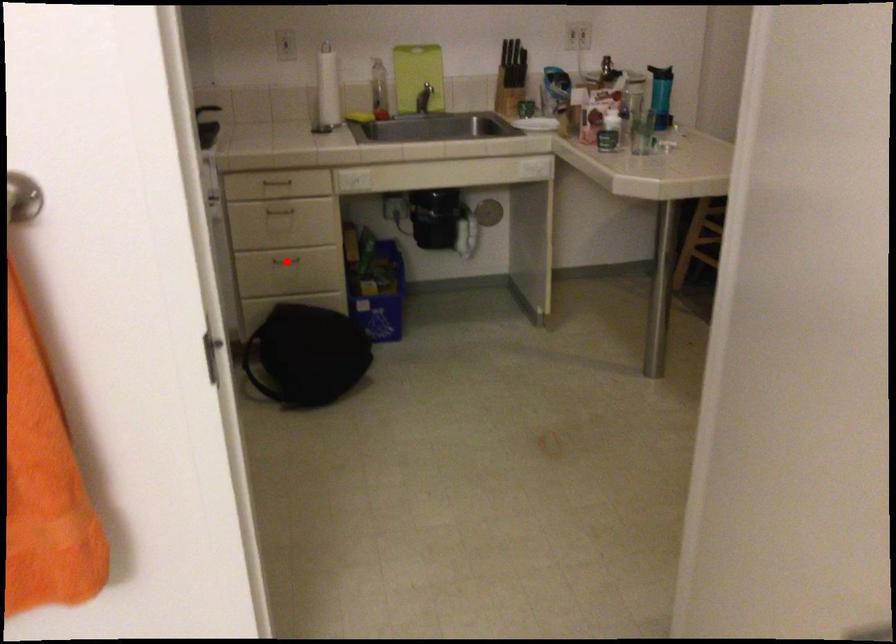
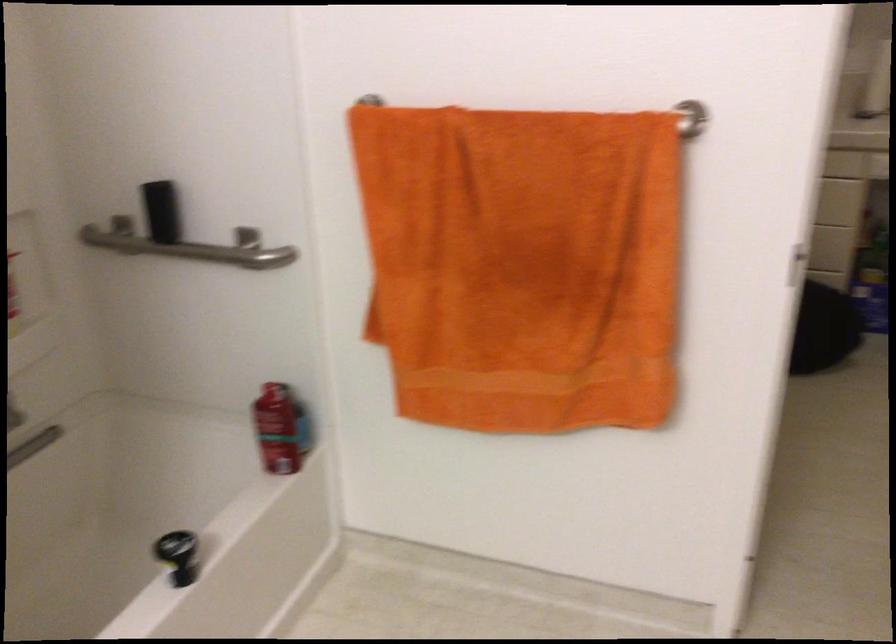
Question: I am providing you with two images of the same scene from different viewpoints. A red point is marked on the first image. At the location where the point appears in image 1, is it still visible in image 2?

Choices:
 (A) Yes
 (B) No

Answer: (B)